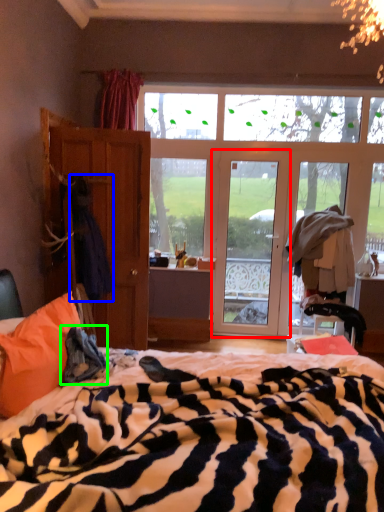
Question: Estimate the real-world distances between objects in this image. Which object is closer to door (highlighted by a red box), laundry (highlighted by a blue box) or cloth (highlighted by a green box)?

Choices:
 (A) laundry
 (B) cloth

Answer: (A)